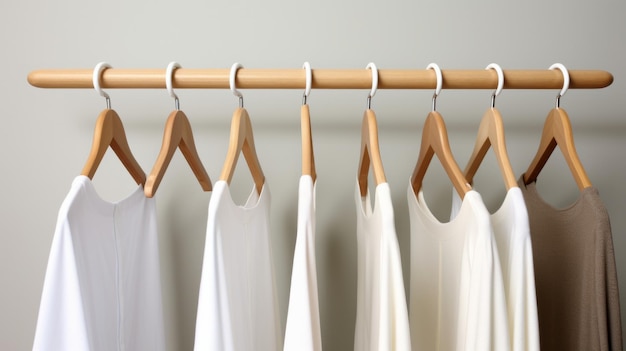
I want to click on clothes hangers, so click(119, 121), click(181, 128), click(242, 129), click(300, 129), click(372, 137), click(424, 132), click(491, 132), click(553, 133).